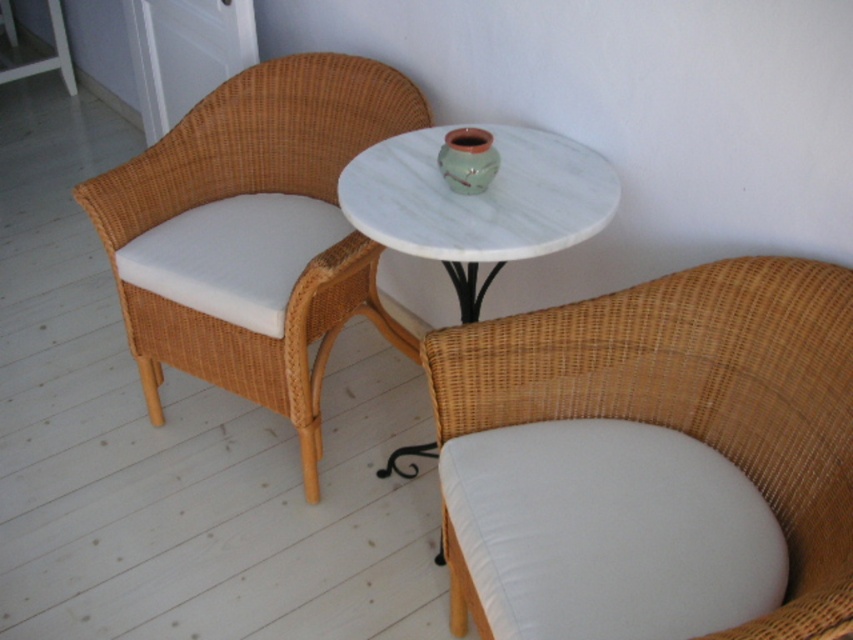
Question: Where is woven rattan armchair at center located in relation to white marble side table at center in the image?

Choices:
 (A) left
 (B) right

Answer: (B)

Question: From the image, what is the correct spatial relationship of woven rattan armchair at center in relation to white marble side table at center?

Choices:
 (A) above
 (B) below

Answer: (B)

Question: Considering the real-world distances, which object is closest to the woven rattan armchair at center?

Choices:
 (A) white marble table at center
 (B) woven rattan armchair at left

Answer: (A)

Question: Which point is farther to the camera?

Choices:
 (A) (451, 426)
 (B) (425, 141)
 (C) (402, 228)

Answer: (B)

Question: Can you confirm if woven rattan armchair at center is positioned below white marble side table at center?

Choices:
 (A) no
 (B) yes

Answer: (B)

Question: Among these points, which one is farthest from the camera?

Choices:
 (A) (302, 56)
 (B) (466, 227)

Answer: (A)